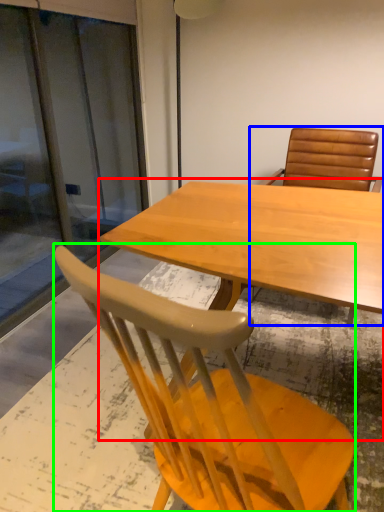
Question: Which object is the closest to the table (highlighted by a red box)? Choose among these: chair (highlighted by a blue box) or chair (highlighted by a green box).

Choices:
 (A) chair
 (B) chair

Answer: (B)